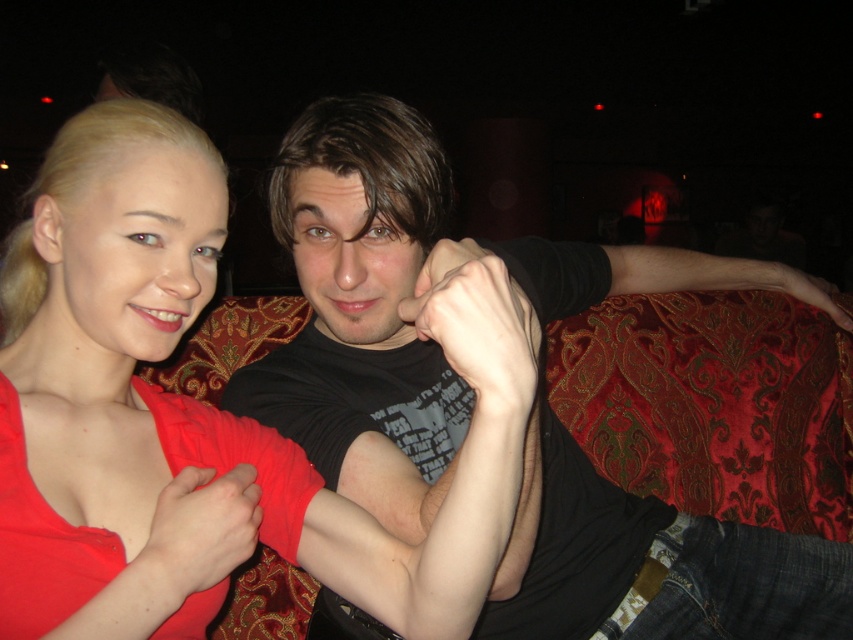
Question: Can you confirm if matte red dress at center is smaller than black matte shirt at center?

Choices:
 (A) yes
 (B) no

Answer: (A)

Question: Can you confirm if matte red dress at center is positioned to the left of black matte shirt at center?

Choices:
 (A) no
 (B) yes

Answer: (B)

Question: Which of the following is the closest to the observer?

Choices:
 (A) black matte shirt at center
 (B) matte red dress at center

Answer: (B)

Question: Which of the following is the farthest from the observer?

Choices:
 (A) black matte shirt at center
 (B) matte red dress at center

Answer: (A)

Question: Is matte red dress at center closer to camera compared to black matte shirt at center?

Choices:
 (A) no
 (B) yes

Answer: (B)